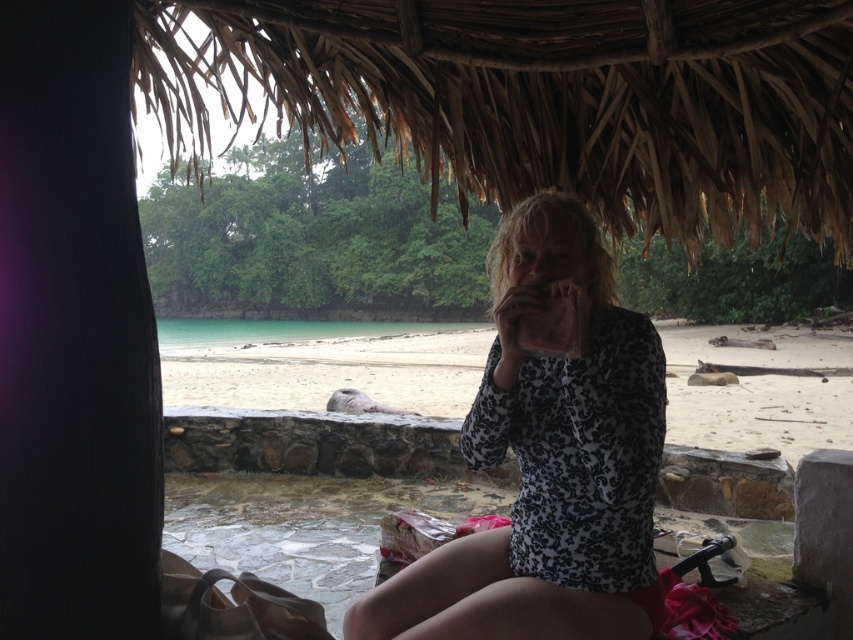
You are a photographer planning to take a photo of the white leopard print dress at center and the beige sand at center. Which object should you focus on first if you want to capture both in the frame without moving the camera, considering their sizes?

The white leopard print dress at center has a lesser width compared to beige sand at center, so you should focus on the beige sand at center first as it occupies more space in the frame.

You are a photographer at the beach. You want to capture a photo of the white leopard print dress at center and the beige sand at center. Based on their positions, which object is located to the right of the other?

The white leopard print dress at center is positioned on the right side of beige sand at center.

You are standing under the thatched roof structure and want to place a small umbrella between the two points marked as point [650,598] and point [788,436]. Which point should you choose to ensure the umbrella is closer to you?

You should choose point [650,598] because it is closer to the viewer than point [788,436].